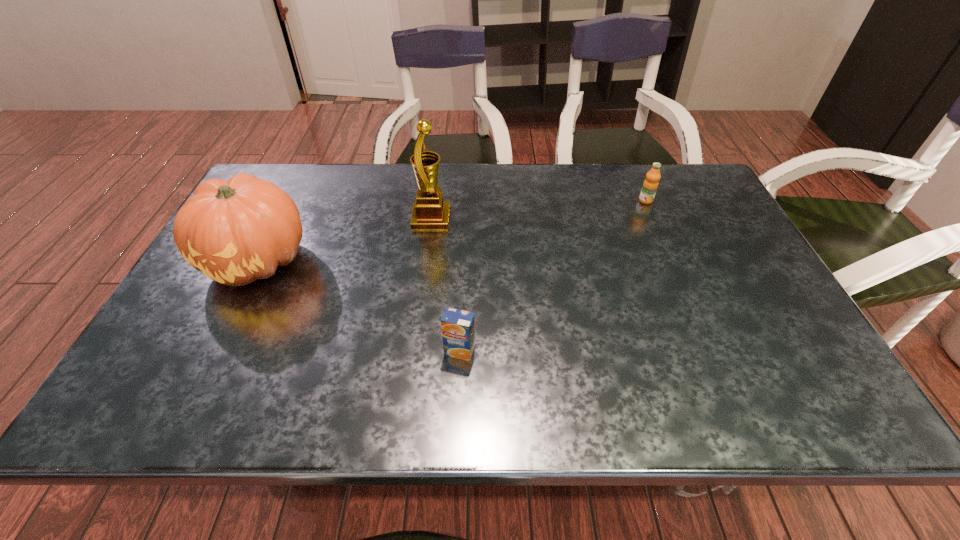
The height and width of the screenshot is (540, 960). Identify the location of free spot between the left orange_juice and the leftmost object. (359, 306).

Locate an element on the screen. free space that is in between the second tallest object and the left orange_juice is located at coordinates (359, 306).

Point out which object is positioned as the second nearest to the nearest object. Please provide its 2D coordinates. Your answer should be formatted as a tuple, i.e. [(x, y)], where the tuple contains the x and y coordinates of a point satisfying the conditions above.

[(235, 231)]

Select which object appears as the third closest to the third object from left to right. Please provide its 2D coordinates. Your answer should be formatted as a tuple, i.e. [(x, y)], where the tuple contains the x and y coordinates of a point satisfying the conditions above.

[(650, 185)]

Find the location of a particular element. The height and width of the screenshot is (540, 960). free point that satisfies the following two spatial constraints: 1. on the label of the rightmost object; 2. on the front-facing side of the award is located at coordinates (654, 219).

The height and width of the screenshot is (540, 960). I want to click on free point that satisfies the following two spatial constraints: 1. on the front-facing side of the tallest object; 2. on the carved face of the pumpkin, so click(x=426, y=260).

The width and height of the screenshot is (960, 540). Identify the location of free location that satisfies the following two spatial constraints: 1. on the label of the farthest object; 2. on the front-facing side of the award. (654, 219).

Where is `vacant point that satisfies the following two spatial constraints: 1. on the front-facing side of the third object from right to left; 2. on the carved face of the second tallest object`? vacant point that satisfies the following two spatial constraints: 1. on the front-facing side of the third object from right to left; 2. on the carved face of the second tallest object is located at coordinates (426, 260).

The height and width of the screenshot is (540, 960). Find the location of `vacant position in the image that satisfies the following two spatial constraints: 1. on the front-facing side of the nearest object; 2. on the right side of the award`. vacant position in the image that satisfies the following two spatial constraints: 1. on the front-facing side of the nearest object; 2. on the right side of the award is located at coordinates (415, 351).

The image size is (960, 540). I want to click on vacant space that satisfies the following two spatial constraints: 1. on the back side of the nearest object; 2. on the front-facing side of the tallest object, so click(x=465, y=219).